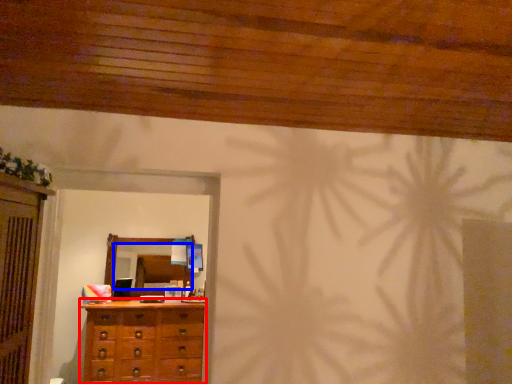
Question: Which point is closer to the camera, chest of drawers (highlighted by a red box) or mirror (highlighted by a blue box)?

Choices:
 (A) chest of drawers
 (B) mirror

Answer: (A)